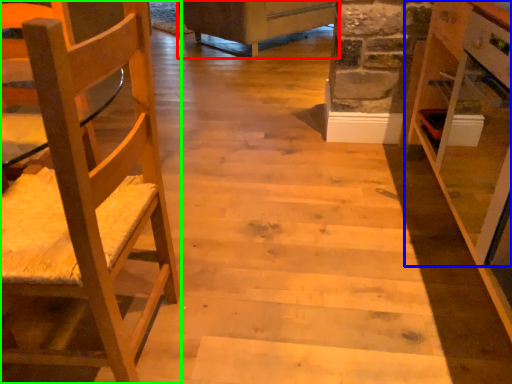
Question: Based on their relative distances, which object is farther from furniture (highlighted by a red box)? Choose from cabinetry (highlighted by a blue box) and chair (highlighted by a green box).

Choices:
 (A) cabinetry
 (B) chair

Answer: (B)